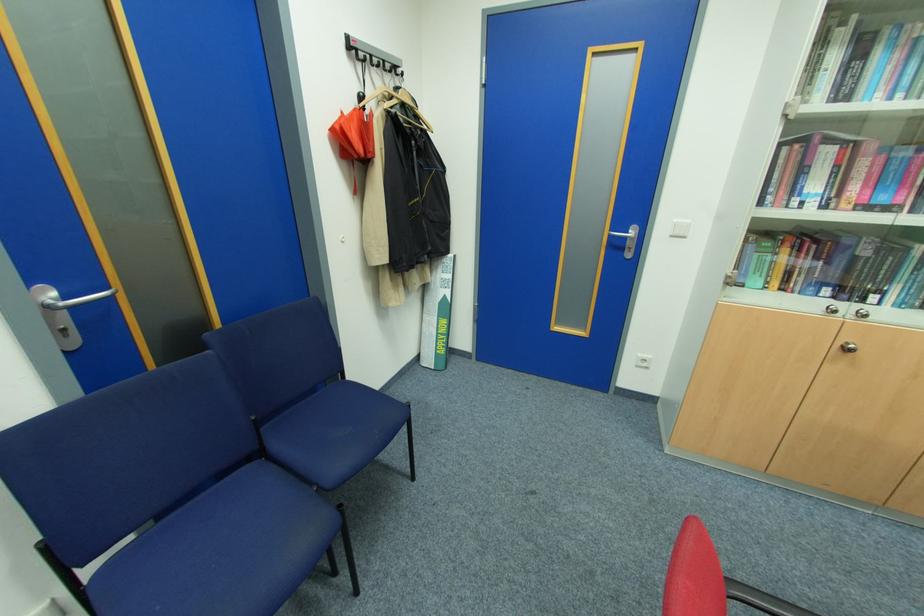
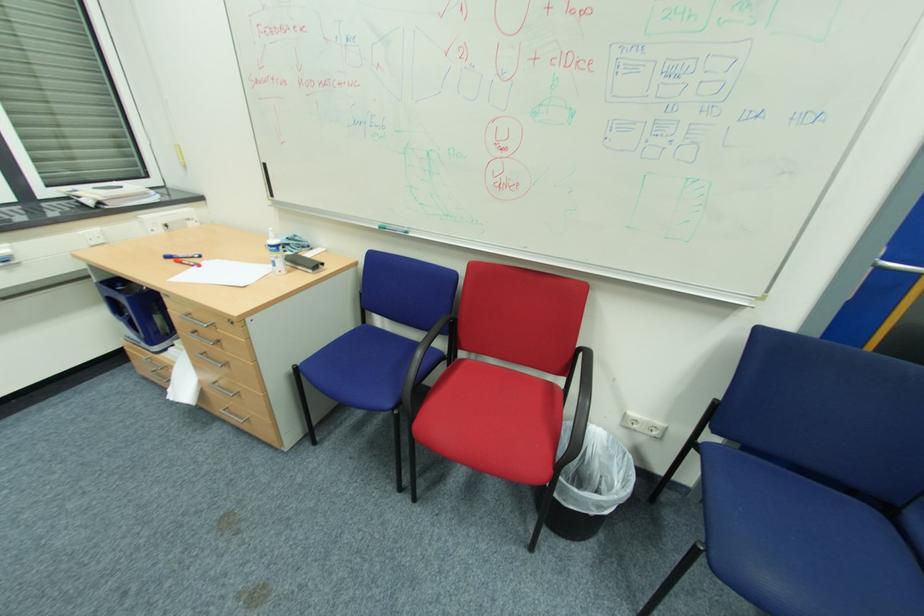
First-person continuous shooting, in which direction is the camera rotating?

The camera's rotation is toward left-down.